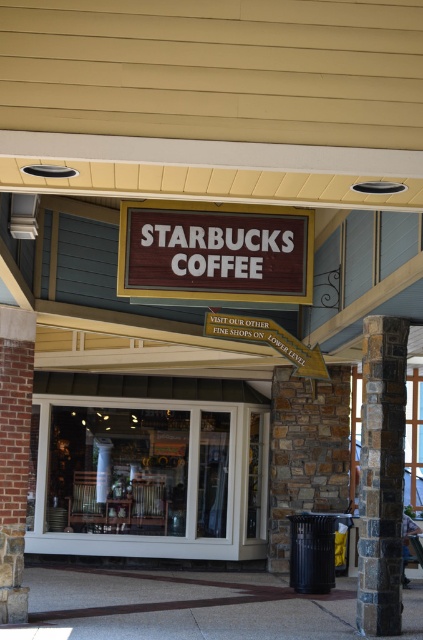
Question: Does wooden sign at center have a larger size compared to stained stone column at right?

Choices:
 (A) yes
 (B) no

Answer: (B)

Question: Can you confirm if white glass door at center is positioned to the right of stained stone column at right?

Choices:
 (A) no
 (B) yes

Answer: (A)

Question: Which of the following is the farthest from the observer?

Choices:
 (A) (299, 218)
 (B) (120, 465)

Answer: (B)

Question: Does white glass door at center appear under stained stone column at right?

Choices:
 (A) no
 (B) yes

Answer: (B)

Question: Which point appears farthest from the camera in this image?

Choices:
 (A) (209, 285)
 (B) (230, 515)

Answer: (B)

Question: Which point is closer to the camera?

Choices:
 (A) (132, 248)
 (B) (253, 451)

Answer: (A)